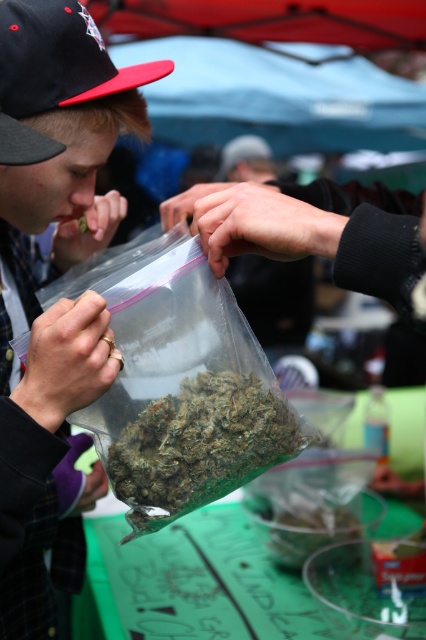
You are a customer at the market and see the green matte marijuana at center and the black fabric baseball cap at upper left. Which item is positioned more to the right in the scene?

The green matte marijuana at center is positioned more to the right than the black fabric baseball cap at upper left.

You are a customer at the market and want to buy the green matte marijuana at center. The vendor is wearing the black fabric baseball cap at upper left. Can you tell which item is larger in size?

The black fabric baseball cap at upper left is larger than the green matte marijuana at center.